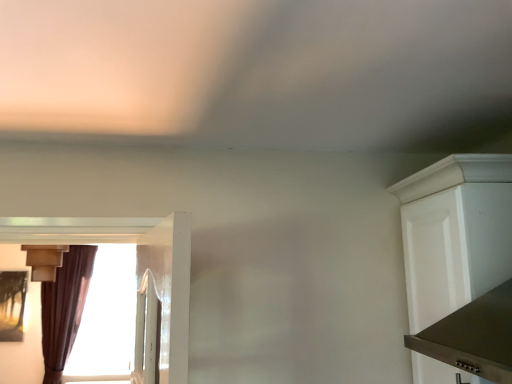
Measure the distance between brown velvet curtain at left and camera.

They are 4.13 meters apart.

Image resolution: width=512 pixels, height=384 pixels. Find the location of `brown velvet curtain at left`. brown velvet curtain at left is located at coordinates (64, 308).

Can brown velvet curtain at left be found inside white matte cabinet at right?

No, brown velvet curtain at left is not surrounded by white matte cabinet at right.

Where is `cabinetry above the brown velvet curtain at left (from the image's perspective)`? The height and width of the screenshot is (384, 512). cabinetry above the brown velvet curtain at left (from the image's perspective) is located at coordinates (455, 233).

From a real-world perspective, is white matte cabinet at right positioned under brown velvet curtain at left based on gravity?

No, from a real-world perspective, white matte cabinet at right is not below brown velvet curtain at left.

Is matte beige light fixture at left looking in the opposite direction of white matte cabinet at right?

matte beige light fixture at left is not turned away from white matte cabinet at right.

How far apart are matte beige light fixture at left and white matte cabinet at right?

10.49 feet.

What's the angular difference between matte beige light fixture at left and white matte cabinet at right's facing directions?

The angular difference between matte beige light fixture at left and white matte cabinet at right is 89.5 degrees.

From a real-world perspective, is matte beige light fixture at left positioned above or below white matte cabinet at right?

matte beige light fixture at left is above white matte cabinet at right.

Is white matte cabinet at right at the right side of matte beige light fixture at left?

Indeed, white matte cabinet at right is positioned on the right side of matte beige light fixture at left.

From a real-world perspective, does white matte cabinet at right stand above matte beige light fixture at left?

No.

Is matte beige light fixture at left located within white matte cabinet at right?

Actually, matte beige light fixture at left is outside white matte cabinet at right.

Based on their positions, is matte beige light fixture at left located to the left or right of brown velvet curtain at left?

Based on their positions, matte beige light fixture at left is located to the right of brown velvet curtain at left.

Can you confirm if matte beige light fixture at left is thinner than brown velvet curtain at left?

In fact, matte beige light fixture at left might be wider than brown velvet curtain at left.

Is matte beige light fixture at left next to brown velvet curtain at left?

There is a gap between matte beige light fixture at left and brown velvet curtain at left.

You are a GUI agent. You are given a task and a screenshot of the screen. Output one action in this format:
    pyautogui.click(x=<x>, y=<y>)
    Task: Click on the curtain directly beneath the matte beige light fixture at left (from a real-world perspective)
    
    Given the screenshot: What is the action you would take?
    pyautogui.click(x=64, y=308)

Are brown velvet curtain at left and matte beige light fixture at left beside each other?

No.

From the image's perspective, which one is positioned lower, brown velvet curtain at left or matte beige light fixture at left?

brown velvet curtain at left appears lower in the image.

From a real-world perspective, is brown velvet curtain at left positioned under matte beige light fixture at left based on gravity?

Yes, from a real-world perspective, brown velvet curtain at left is below matte beige light fixture at left.

Does brown velvet curtain at left have a lesser height compared to matte beige light fixture at left?

No.

Is white matte cabinet at right located within brown velvet curtain at left?

No, white matte cabinet at right is not a part of brown velvet curtain at left.

Find the location of a particular element. The image size is (512, 384). curtain that is below the white matte cabinet at right (from the image's perspective) is located at coordinates (64, 308).

Considering the points (86, 260) and (453, 287), which point is in front, point (86, 260) or point (453, 287)?

Point (453, 287)

In the image, is brown velvet curtain at left positioned in front of or behind white matte cabinet at right?

brown velvet curtain at left is positioned farther from the viewer than white matte cabinet at right.

Identify the location of cabinetry on the right of brown velvet curtain at left. (455, 233).

Where is `cabinetry below the matte beige light fixture at left (from a real-world perspective)`? This screenshot has width=512, height=384. cabinetry below the matte beige light fixture at left (from a real-world perspective) is located at coordinates (455, 233).

Considering their positions, is white matte cabinet at right positioned further to brown velvet curtain at left than matte beige light fixture at left?

Based on the image, white matte cabinet at right appears to be further to brown velvet curtain at left.

Considering their positions, is brown velvet curtain at left positioned closer to white matte cabinet at right than matte beige light fixture at left?

matte beige light fixture at left is closer to white matte cabinet at right.

From the image, which object appears to be nearer to brown velvet curtain at left, matte beige light fixture at left or white matte cabinet at right?

matte beige light fixture at left lies closer to brown velvet curtain at left than the other object.

Considering their positions, is white matte cabinet at right positioned further to matte beige light fixture at left than brown velvet curtain at left?

Based on the image, white matte cabinet at right appears to be further to matte beige light fixture at left.

Consider the image. Estimate the real-world distances between objects in this image. Which object is closer to white matte cabinet at right, matte beige light fixture at left or brown velvet curtain at left?

The object closer to white matte cabinet at right is matte beige light fixture at left.

Which object lies nearer to the anchor point matte beige light fixture at left, brown velvet curtain at left or white matte cabinet at right?

brown velvet curtain at left is closer to matte beige light fixture at left.

You are a GUI agent. You are given a task and a screenshot of the screen. Output one action in this format:
    pyautogui.click(x=<x>, y=<y>)
    Task: Click on the light fixture between white matte cabinet at right and brown velvet curtain at left from front to back
    This screenshot has width=512, height=384.
    Given the screenshot: What is the action you would take?
    pyautogui.click(x=44, y=261)